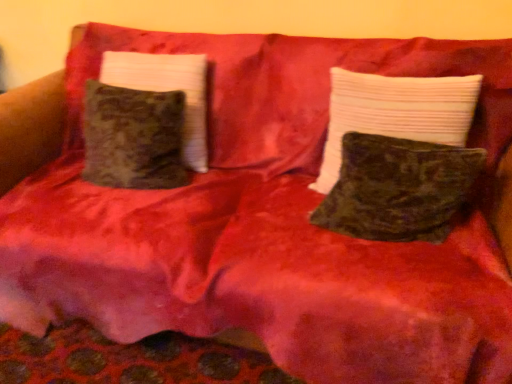
Question: Looking at their shapes, would you say velvet green pillow at center, the third pillow viewed from the left, is wider or thinner than velvety dark green pillow at center, placed as the second pillow when sorted from right to left?

Choices:
 (A) wide
 (B) thin

Answer: (B)

Question: From the image's perspective, relative to velvety dark green pillow at center, placed as the second pillow when sorted from right to left, is velvet green pillow at center, which ranks as the first pillow in right-to-left order, above or below?

Choices:
 (A) below
 (B) above

Answer: (B)

Question: Estimate the real-world distances between objects in this image. Which object is closer to the velvet green pillow at center, the third pillow viewed from the left?

Choices:
 (A) velvet green pillow at left, the third pillow from the right
 (B) velvety dark green pillow at center, marked as the second pillow in a left-to-right arrangement

Answer: (B)

Question: Estimate the real-world distances between objects in this image. Which object is farther from the velvety dark green pillow at center, marked as the second pillow in a left-to-right arrangement?

Choices:
 (A) velvet green pillow at left, the third pillow from the right
 (B) velvet green pillow at center, the third pillow viewed from the left

Answer: (A)